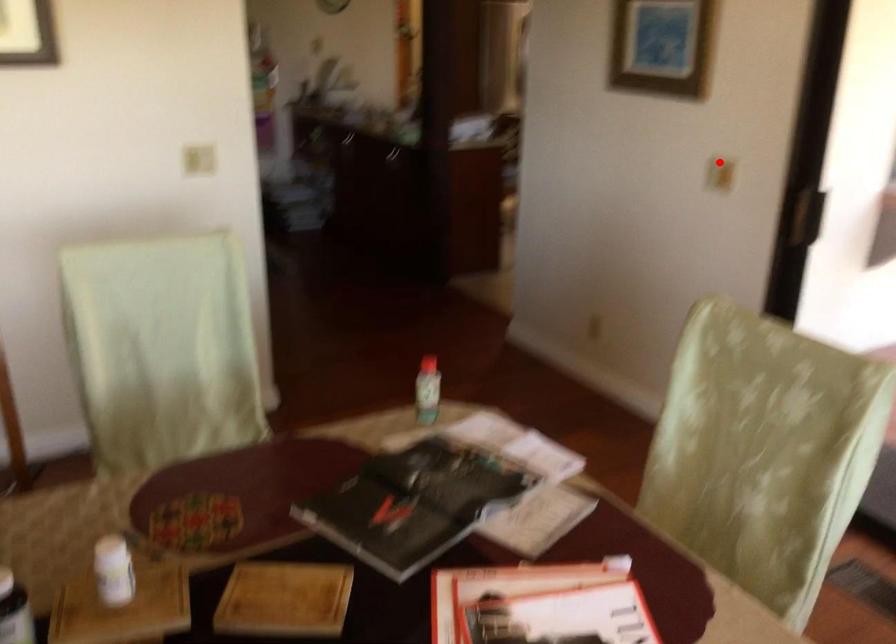
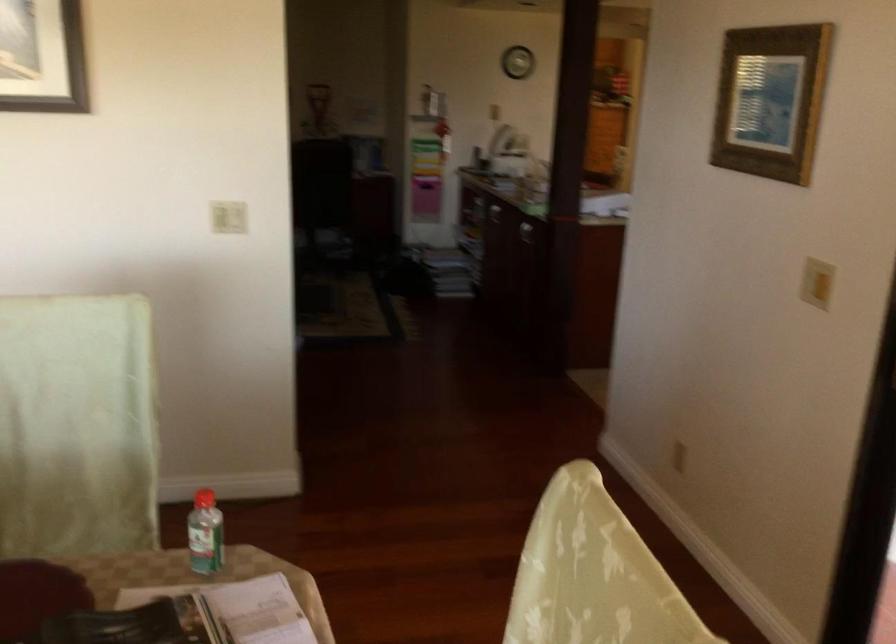
Find the pixel in the second image that matches the highlighted location in the first image.

(816, 283)